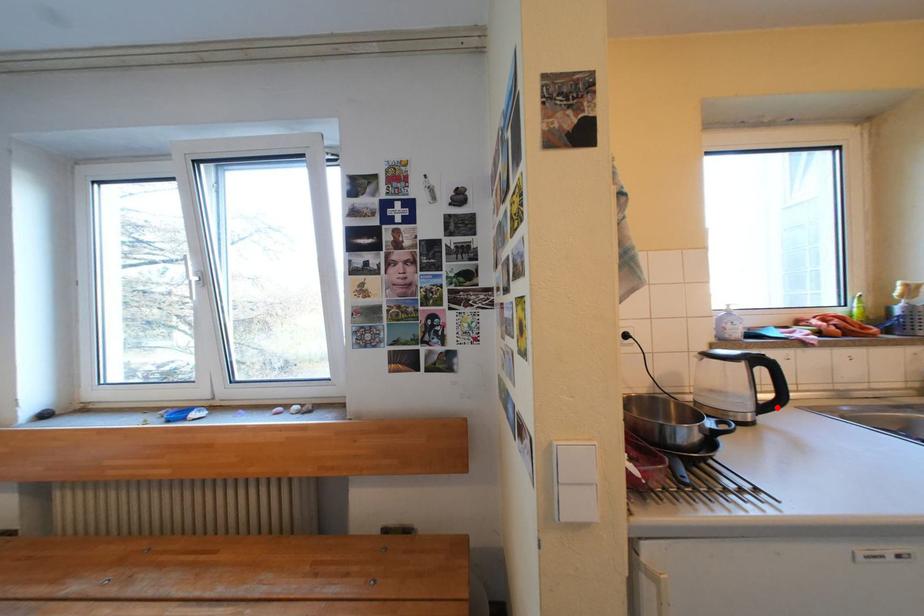
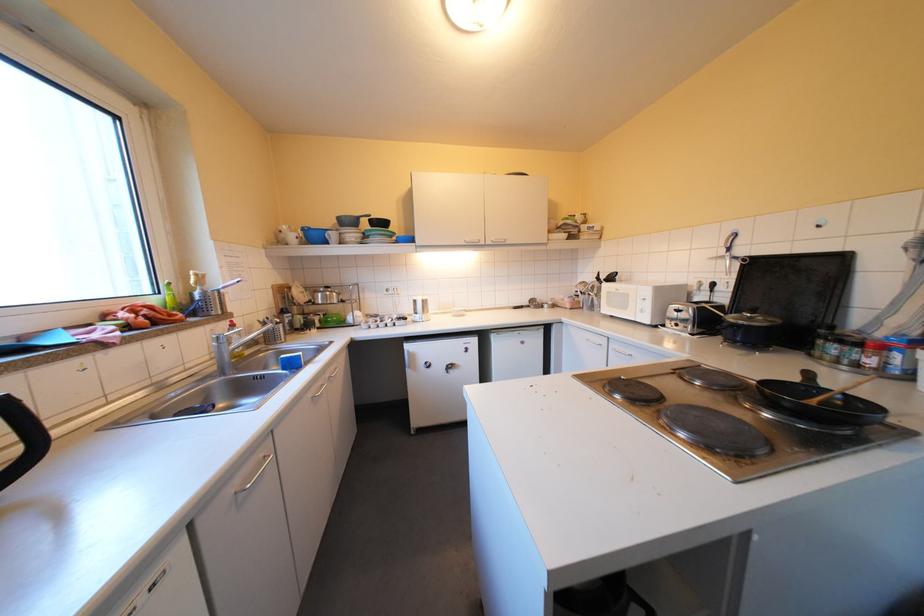
In the second image, find the point that corresponds to the highlighted location in the first image.

(17, 479)